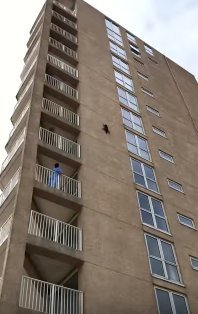
Locate an element on the screen. Image resolution: width=198 pixels, height=314 pixels. glass part of window is located at coordinates (156, 254).